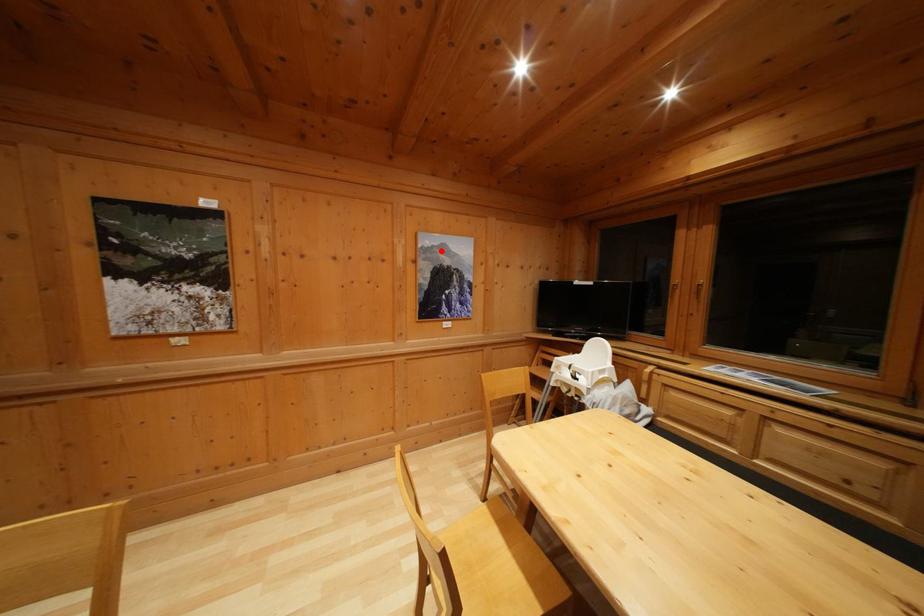
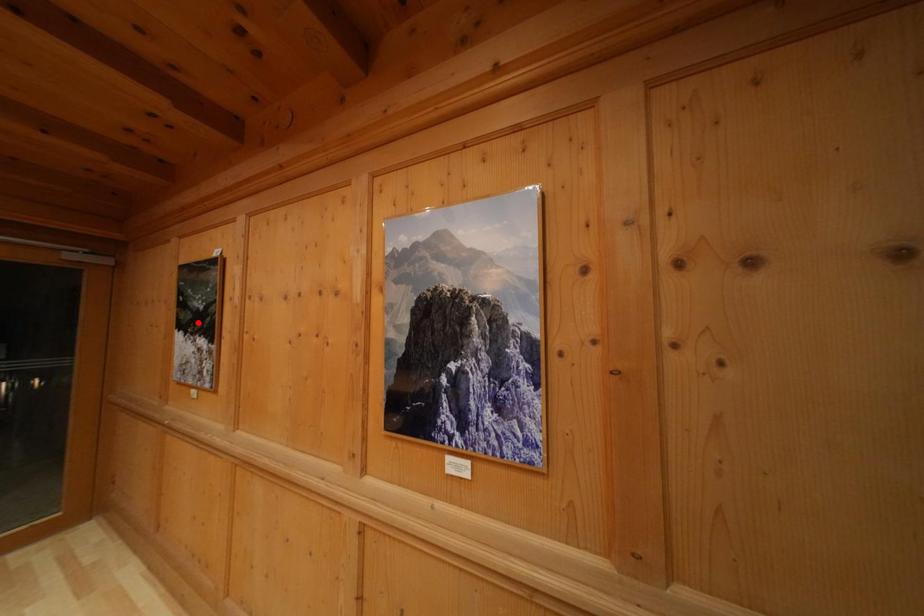
I am providing you with two images of the same scene from different viewpoints. A red point is marked on the first image and another point is marked on the second image. Is the marked point in image1 the same physical position as the marked point in image2?

No